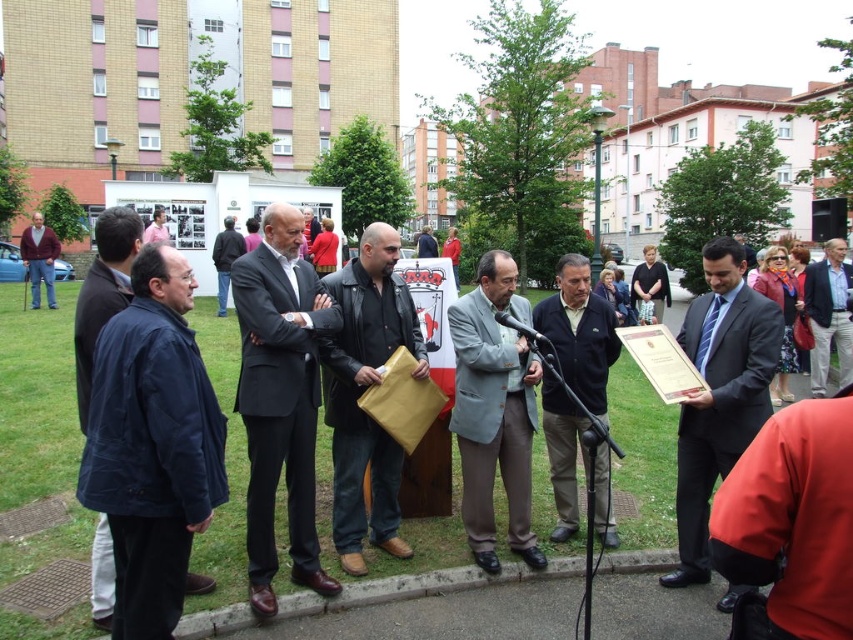
Between point (535, 570) and point (218, 301), which one is positioned behind?

Point (218, 301)

The height and width of the screenshot is (640, 853). What are the coordinates of `light gray suit at center` in the screenshot? It's located at (494, 410).

Between dark gray suit at center and light blue shirt at center, which one is positioned higher?

light blue shirt at center is higher up.

How far apart are dark gray suit at center and light blue shirt at center?

dark gray suit at center and light blue shirt at center are 11.48 meters apart.

Does point (314, 538) come farther from viewer compared to point (143, 240)?

No, (314, 538) is in front of (143, 240).

The image size is (853, 640). What are the coordinates of `dark gray suit at center` in the screenshot? It's located at (280, 400).

In the scene shown: Is maroon fabric jacket at left positioned at the back of black plastic microphone at center?

Yes, maroon fabric jacket at left is behind black plastic microphone at center.

Does maroon fabric jacket at left have a greater width compared to black plastic microphone at center?

Correct, the width of maroon fabric jacket at left exceeds that of black plastic microphone at center.

Between point (35, 253) and point (498, 321), which one is positioned behind?

Point (35, 253)

At what (x,y) coordinates should I click in order to perform the action: click on maroon fabric jacket at left. Please return your answer as a coordinate pair (x, y). Looking at the image, I should click on (39, 259).